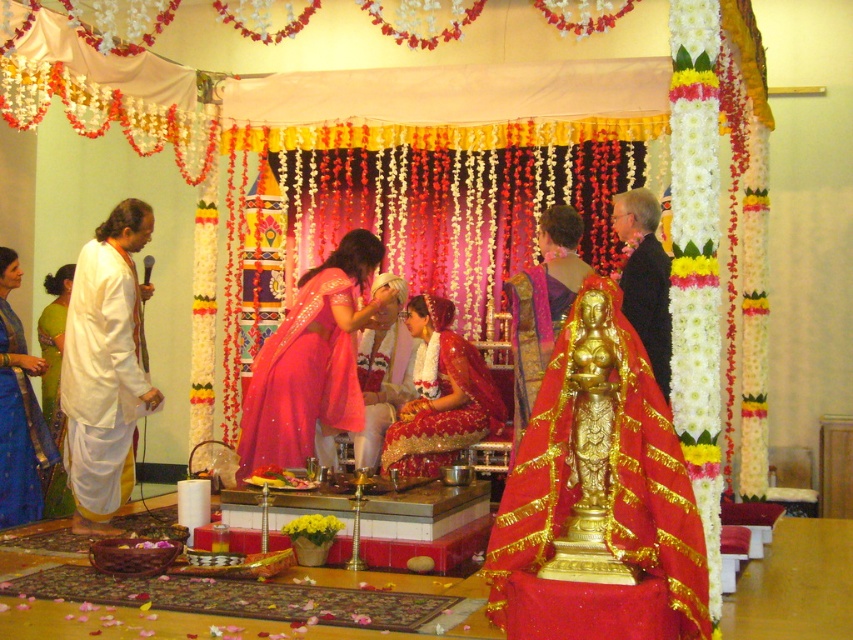
You are a photographer at the wedding and need to capture both the white cotton robe at left and the blue silk saree at left in a single frame. Which clothing item should you focus on first to ensure both are in the shot?

The white cotton robe at left is larger in size compared to the blue silk saree at left, so focusing on the white cotton robe at left first will help ensure both fit within the frame.

In the context of the traditional Indian wedding ceremony depicted, there is a gold metallic statue at center and a green silk saree at left. Which object occupies a larger area in the image?

The green silk saree at left is larger than the gold metallic statue at center.

Consider the image. You are attending a traditional Indian wedding and notice two points marked in the scene. Which point, point (381,410) or point (64,506), is closer to you?

Point (381,410) is further to the viewer than point (64,506), so the closer point to you is point (64,506).